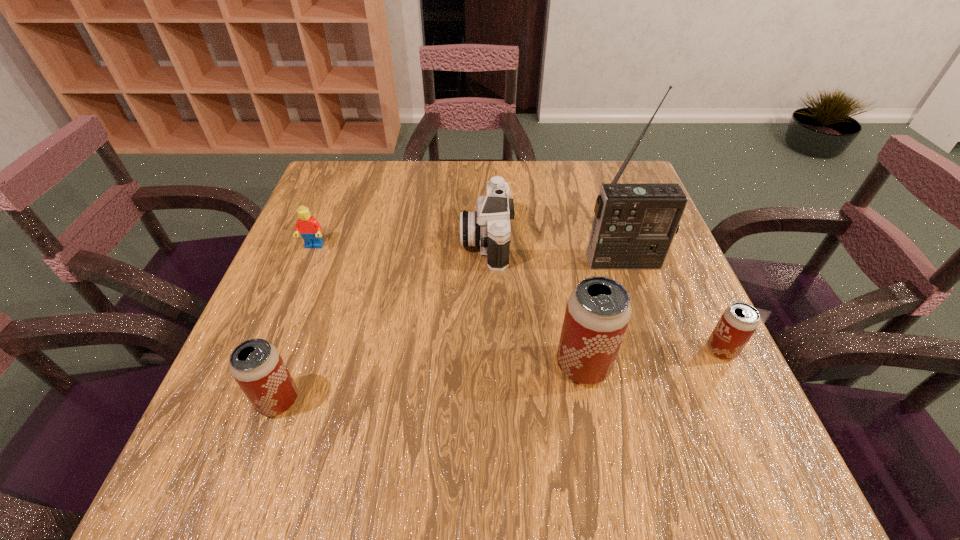
Identify the location of vacant space at the far edge. (577, 163).

Image resolution: width=960 pixels, height=540 pixels. I want to click on free space at the near edge, so click(618, 426).

Find the location of a particular element. The image size is (960, 540). vacant space at the left edge is located at coordinates (273, 314).

Find the location of a particular element. This screenshot has height=540, width=960. vacant area at the far left corner is located at coordinates (345, 179).

Image resolution: width=960 pixels, height=540 pixels. In order to click on free space at the near right corner of the desktop in this screenshot , I will do `click(732, 401)`.

You are a GUI agent. You are given a task and a screenshot of the screen. Output one action in this format:
    pyautogui.click(x=<x>, y=<y>)
    Task: Click on the blank region between the leftmost beer can and the fifth object from left to right
    Image resolution: width=960 pixels, height=540 pixels.
    Given the screenshot: What is the action you would take?
    pyautogui.click(x=451, y=331)

At what (x,y) coordinates should I click in order to perform the action: click on vacant area that lies between the camera and the fifth object from left to right. Please return your answer as a coordinate pair (x, y). Image resolution: width=960 pixels, height=540 pixels. Looking at the image, I should click on (555, 250).

Locate an element on the screen. This screenshot has width=960, height=540. empty location between the leftmost beer can and the tallest beer can is located at coordinates (431, 383).

Image resolution: width=960 pixels, height=540 pixels. I want to click on empty location between the second beer can from right to left and the second tallest beer can, so click(x=431, y=383).

The image size is (960, 540). What are the coordinates of `vacant region between the leftmost beer can and the tallest object` in the screenshot? It's located at (451, 331).